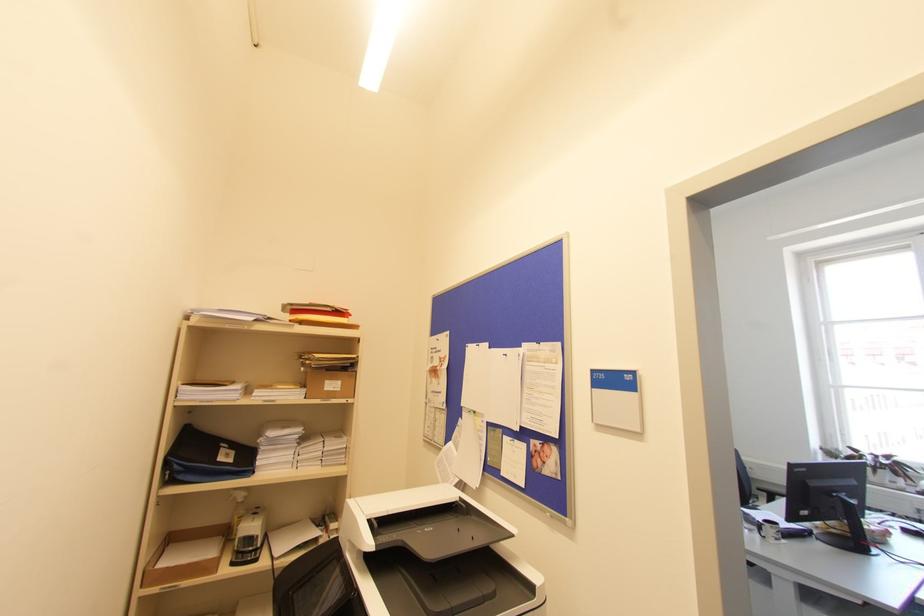
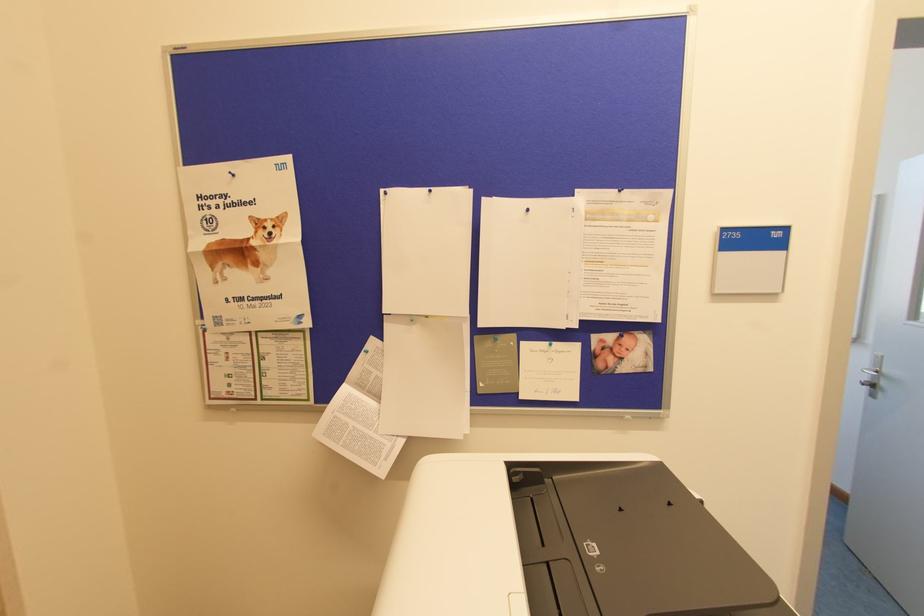
Find the pixel in the second image that matches pixel 540 342 in the first image.

(619, 190)